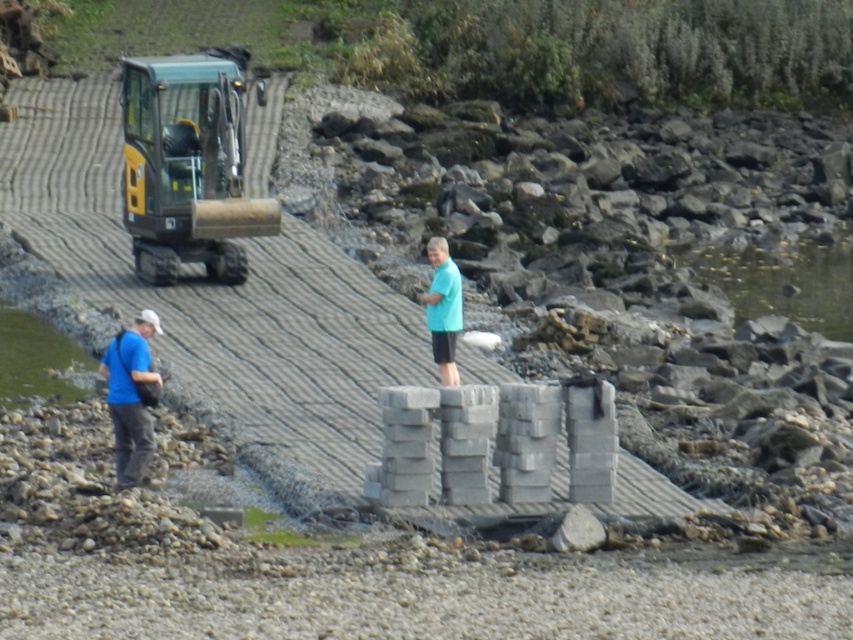
Between yellow-green metallic excavator at upper left and blue fabric bag at lower left, which one appears on the right side from the viewer's perspective?

blue fabric bag at lower left

What do you see at coordinates (187, 168) in the screenshot?
I see `yellow-green metallic excavator at upper left` at bounding box center [187, 168].

Image resolution: width=853 pixels, height=640 pixels. In order to click on yellow-green metallic excavator at upper left in this screenshot , I will do `click(187, 168)`.